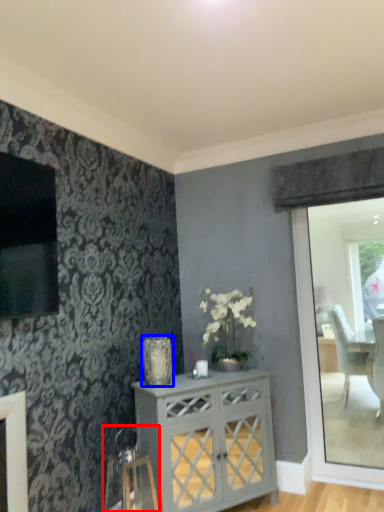
Question: Among these objects, which one is farthest to the camera, swivel chair (highlighted by a red box) or vase (highlighted by a blue box)?

Choices:
 (A) swivel chair
 (B) vase

Answer: (B)